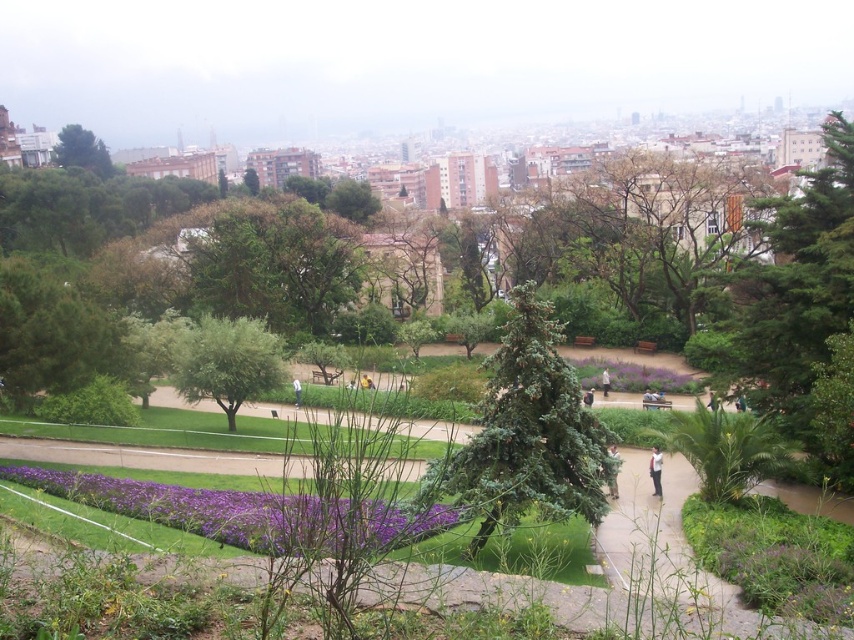
You are standing at the entrance of the park and see the purple matte flower at lower left and the white fabric person at center. Which object is closer to you?

The purple matte flower at lower left is closer to you because it is positioned under the white fabric person at center, indicating it is in front.

You are a photographer standing at the edge of the park. You want to take a photo that includes both the green leafy tree at center and the light brown leather jacket at center. Which object should you focus on first to ensure both are in sharp focus?

To ensure both the green leafy tree at center and the light brown leather jacket at center are in sharp focus, you should focus on the green leafy tree at center first since it is closer to you than the light brown leather jacket at center.